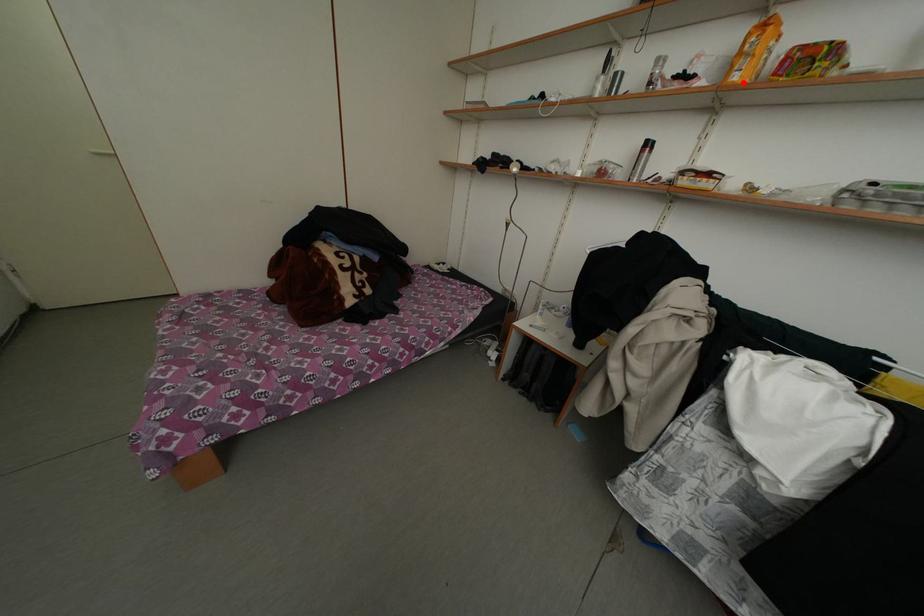
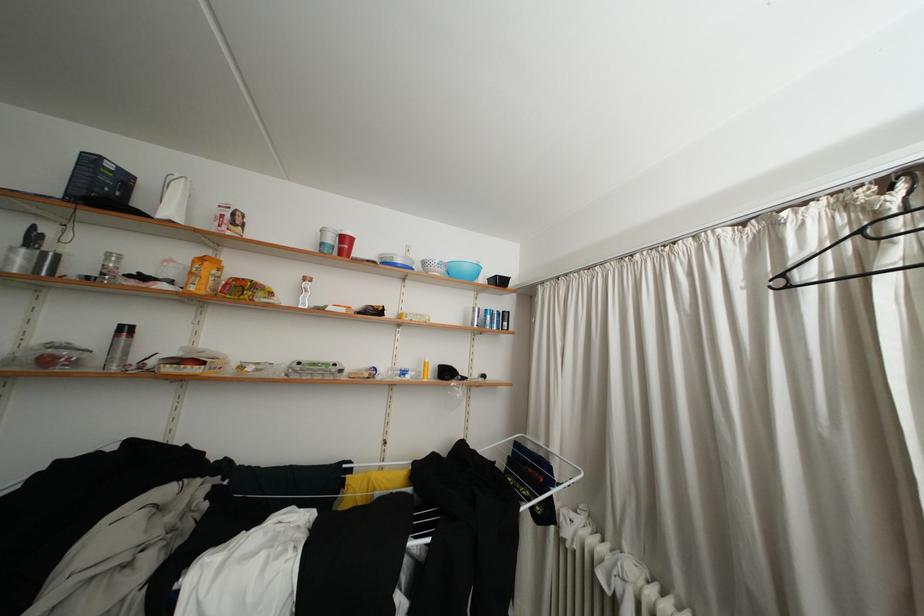
The point at the highlighted location is marked in the first image. Where is the corresponding point in the second image?

(200, 294)